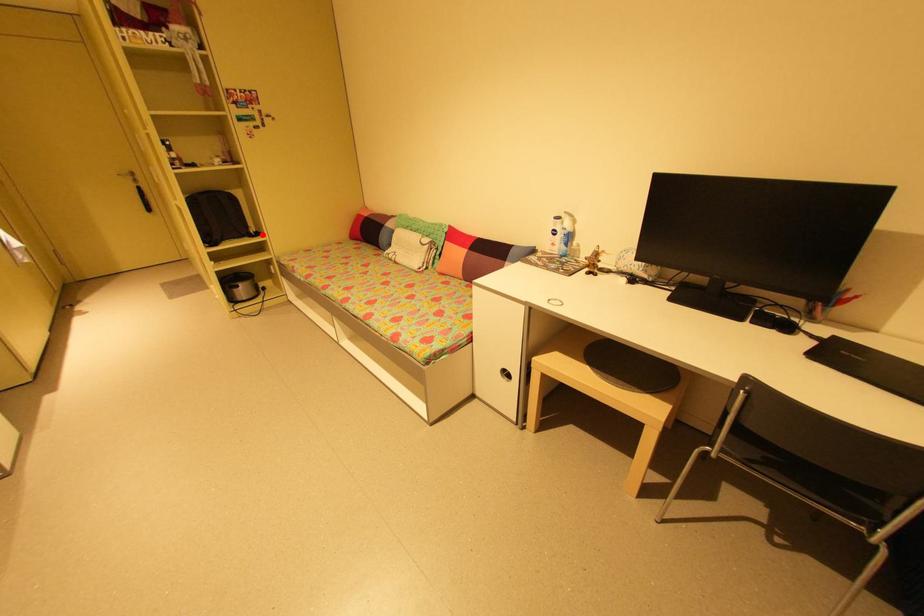
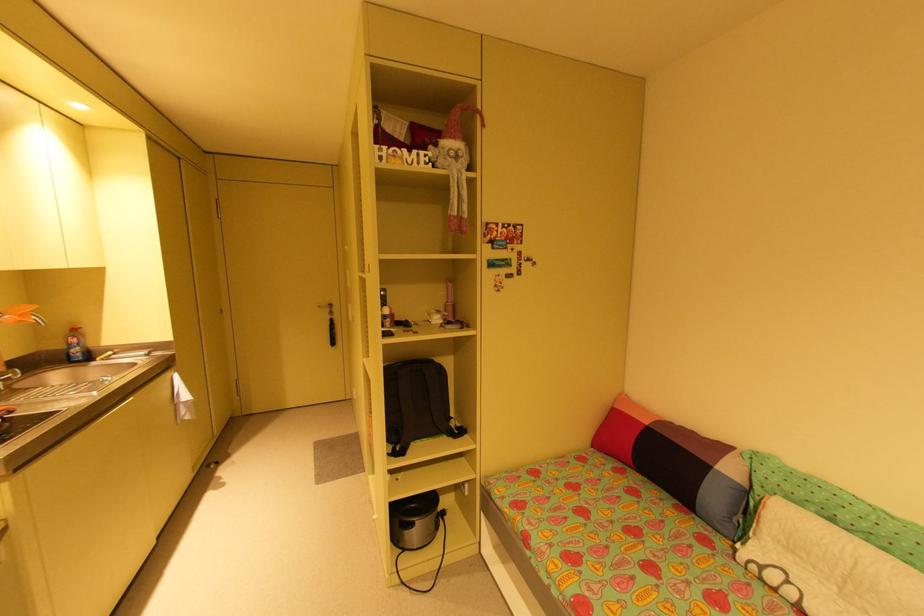
Question: I am providing you with two images of the same scene from different viewpoints. Given a red point in image1, look at the same physical point in image2. Is it:

Choices:
 (A) Closer to the viewpoint
 (B) Farther from the viewpoint

Answer: (B)